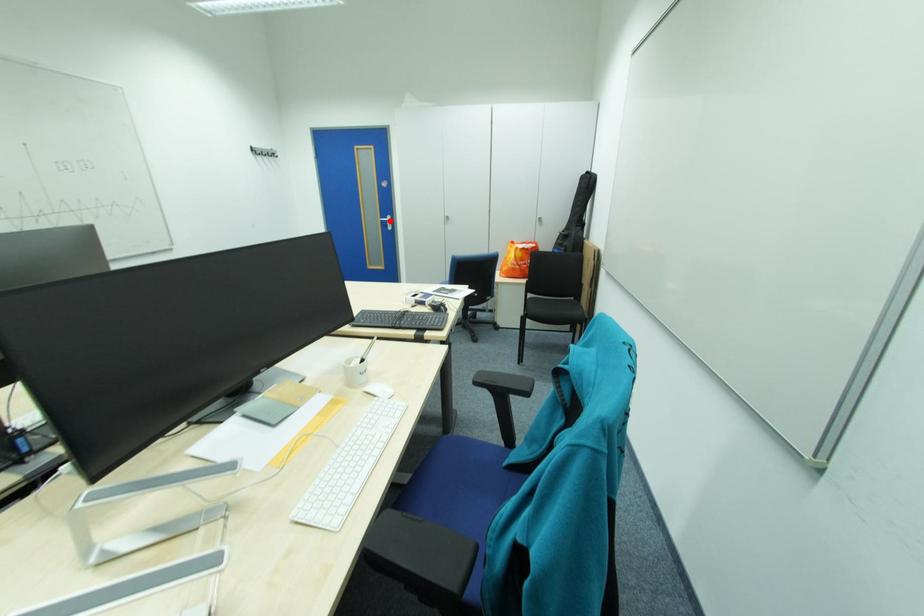
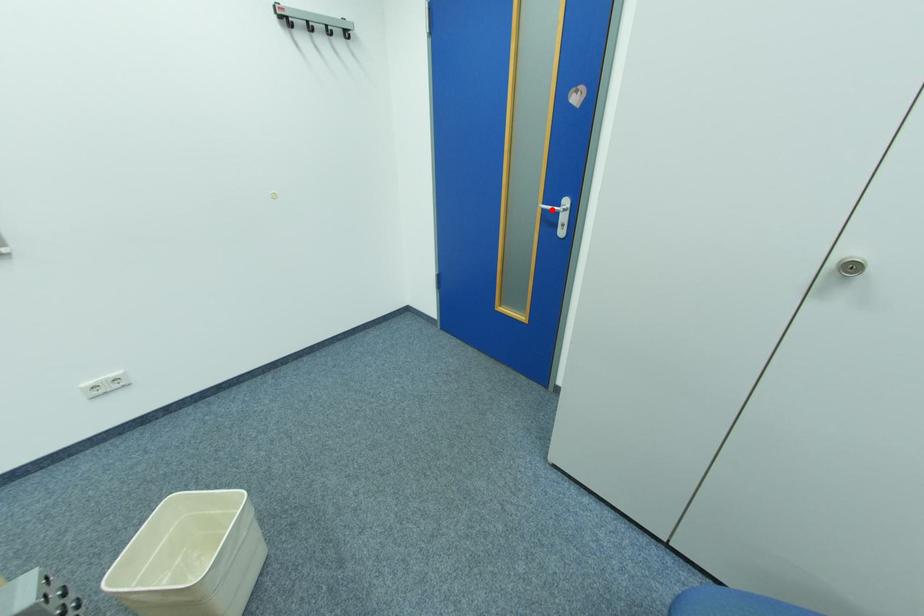
I am providing you with two images of the same scene from different viewpoints. A red point is marked on the first image and another point is marked on the second image. Do the highlighted points in image1 and image2 indicate the same real-world spot?

Yes